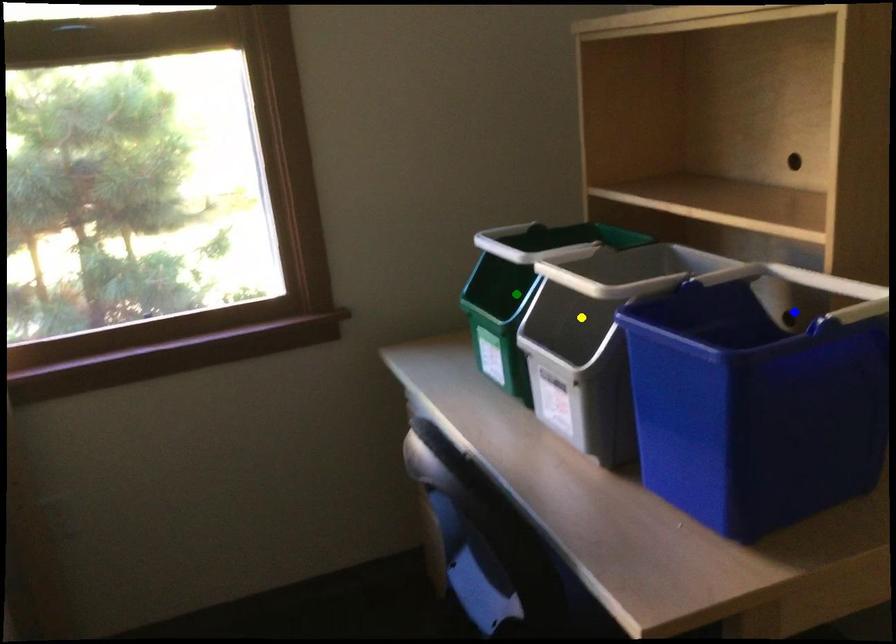
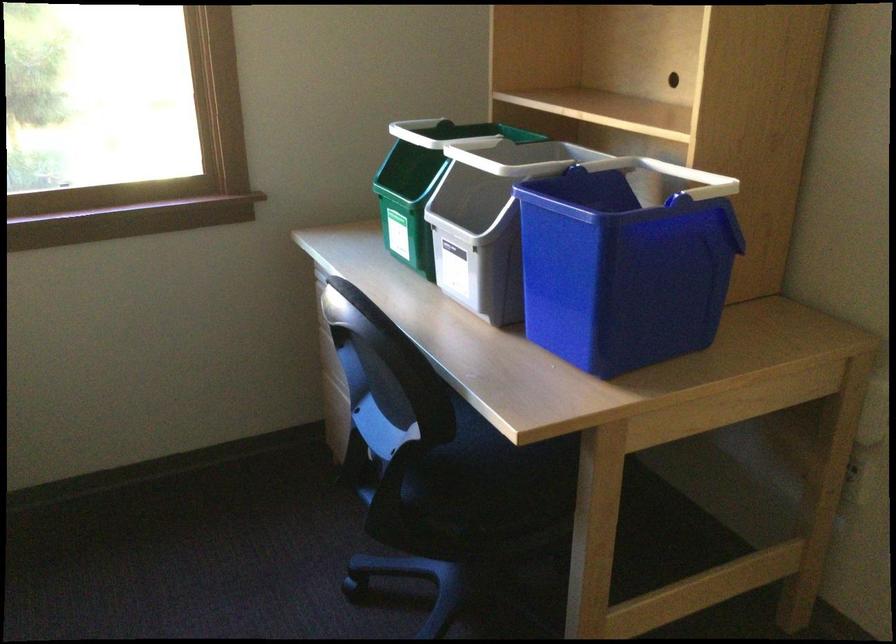
I am providing you with two images of the same scene from different viewpoints. Three points are marked in image1. Which point corresponds to a part or object that is occluded in image2?In image1, three points are marked. Which of them correspond to a part or object that is occluded in image2?Among the three points shown in image1, which one corresponds to a part or object that is no longer visible due to occlusion in image2?

Invisible in image2: blue point.